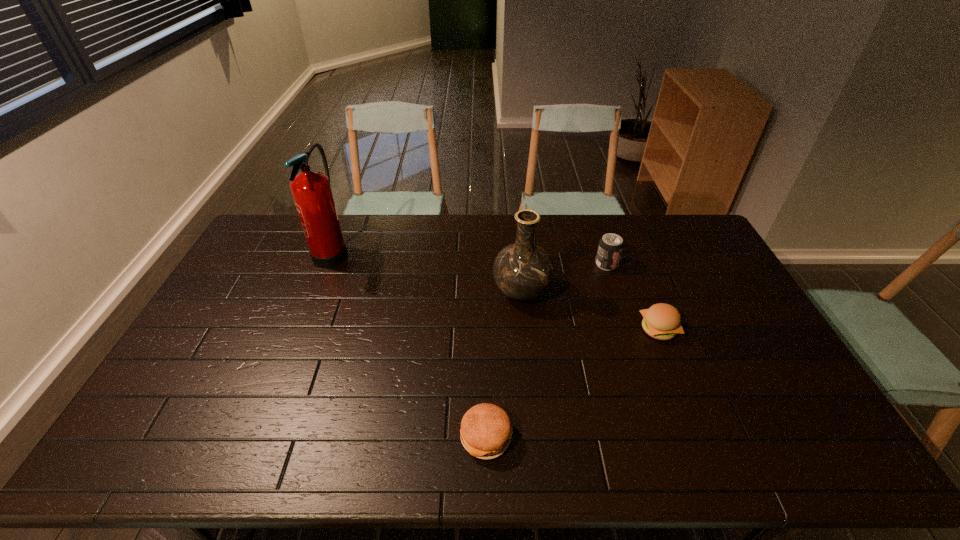
Locate which object ranks second in proximity to the tallest object. Please provide its 2D coordinates. Your answer should be formatted as a tuple, i.e. [(x, y)], where the tuple contains the x and y coordinates of a point satisfying the conditions above.

[(486, 430)]

Where is `vacant area that satisfies the following two spatial constraints: 1. on the back side of the left hamburger; 2. on the right side of the vase`? The height and width of the screenshot is (540, 960). vacant area that satisfies the following two spatial constraints: 1. on the back side of the left hamburger; 2. on the right side of the vase is located at coordinates (485, 292).

At what (x,y) coordinates should I click in order to perform the action: click on free region that satisfies the following two spatial constraints: 1. on the back side of the fourth tallest object; 2. on the right side of the left hamburger. Please return your answer as a coordinate pair (x, y). Looking at the image, I should click on (485, 329).

Locate an element on the screen. The height and width of the screenshot is (540, 960). vacant position in the image that satisfies the following two spatial constraints: 1. on the front side of the third shortest object; 2. on the left side of the leftmost object is located at coordinates (327, 264).

You are a GUI agent. You are given a task and a screenshot of the screen. Output one action in this format:
    pyautogui.click(x=<x>, y=<y>)
    Task: Click on the free space that satisfies the following two spatial constraints: 1. on the front side of the tallest object; 2. on the left side of the farther hamburger
    This screenshot has height=540, width=960.
    Given the screenshot: What is the action you would take?
    pyautogui.click(x=301, y=329)

This screenshot has width=960, height=540. I want to click on free space that satisfies the following two spatial constraints: 1. on the front side of the second tallest object; 2. on the right side of the fire extinguisher, so click(x=316, y=292).

The image size is (960, 540). Identify the location of free point that satisfies the following two spatial constraints: 1. on the front side of the leftmost object; 2. on the left side of the soda can. (327, 264).